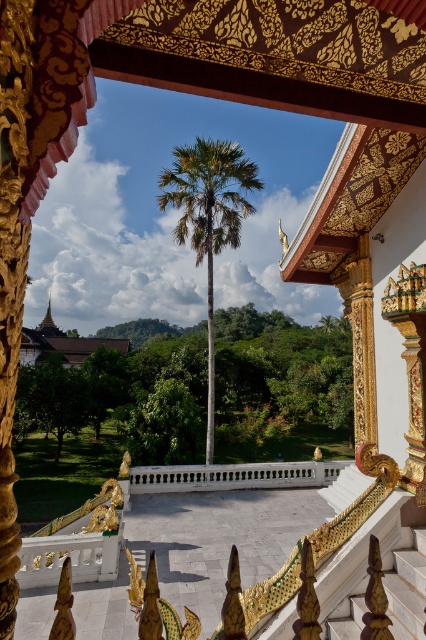
Question: Can you confirm if green leafy palm at center is bigger than white marble balustrade at center?

Choices:
 (A) no
 (B) yes

Answer: (B)

Question: Which of the following is the closest to the observer?

Choices:
 (A) white marble balustrade at center
 (B) green leafy palm at center

Answer: (A)

Question: Which of the following is the closest to the observer?

Choices:
 (A) (196, 465)
 (B) (224, 184)

Answer: (A)

Question: Does green leafy palm at center have a smaller size compared to white marble balustrade at center?

Choices:
 (A) yes
 (B) no

Answer: (B)

Question: Is green leafy palm at center smaller than white marble balustrade at center?

Choices:
 (A) yes
 (B) no

Answer: (B)